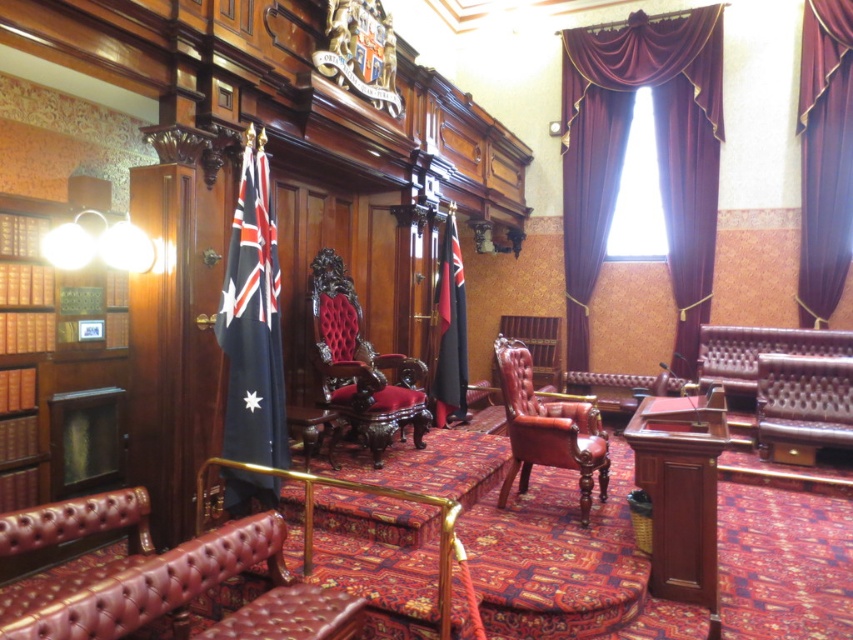
How distant is leather tufted chair at center from black fabric flag at center?

A distance of 11.24 feet exists between leather tufted chair at center and black fabric flag at center.

Does leather tufted chair at center have a smaller size compared to black fabric flag at center?

No.

Where is `leather tufted chair at center`? The width and height of the screenshot is (853, 640). leather tufted chair at center is located at coordinates (181, 593).

Image resolution: width=853 pixels, height=640 pixels. What are the coordinates of `leather tufted armchair at right` in the screenshot? It's located at (802, 404).

Is leather tufted armchair at right closer to the viewer compared to black fabric flag at center?

Yes, it is.

This screenshot has height=640, width=853. Find the location of `leather tufted armchair at right`. leather tufted armchair at right is located at coordinates (802, 404).

Who is more distant from viewer, [257,452] or [440,328]?

Positioned behind is point [440,328].

Who is more forward, (262, 483) or (453, 259)?

Point (262, 483) is in front.

Does point (264, 417) lie behind point (447, 241)?

No.

At what (x,y) coordinates should I click in order to perform the action: click on blue fabric flag at left. Please return your answer as a coordinate pair (x, y). This screenshot has height=640, width=853. Looking at the image, I should click on (252, 321).